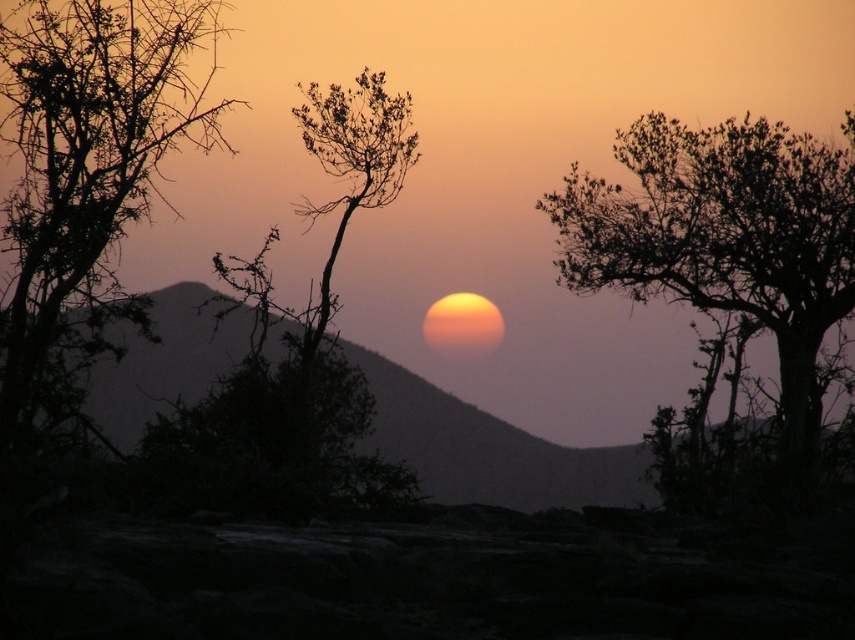
Image resolution: width=855 pixels, height=640 pixels. What do you see at coordinates (87, 154) in the screenshot?
I see `silhouette leafy tree at left` at bounding box center [87, 154].

Is point (98, 273) positioned before point (392, 193)?

Yes, it is in front of point (392, 193).

Find the location of a particular element. silhouette leafy tree at left is located at coordinates (87, 154).

Is silhouette leafy tree at upper right to the right of silhouette leafy tree at left from the viewer's perspective?

Yes, silhouette leafy tree at upper right is to the right of silhouette leafy tree at left.

Who is taller, silhouette leafy tree at upper right or silhouette leafy tree at left?

silhouette leafy tree at left is taller.

This screenshot has width=855, height=640. What do you see at coordinates (726, 243) in the screenshot?
I see `silhouette leafy tree at upper right` at bounding box center [726, 243].

What are the coordinates of `silhouette leafy tree at upper right` in the screenshot? It's located at click(x=726, y=243).

In the scene shown: Between silhouette leafy tree at upper right and bare branches at center, which one appears on the right side from the viewer's perspective?

From the viewer's perspective, silhouette leafy tree at upper right appears more on the right side.

Consider the image. Is the position of silhouette leafy tree at upper right more distant than that of bare branches at center?

That is True.

Identify the location of silhouette leafy tree at upper right. (726, 243).